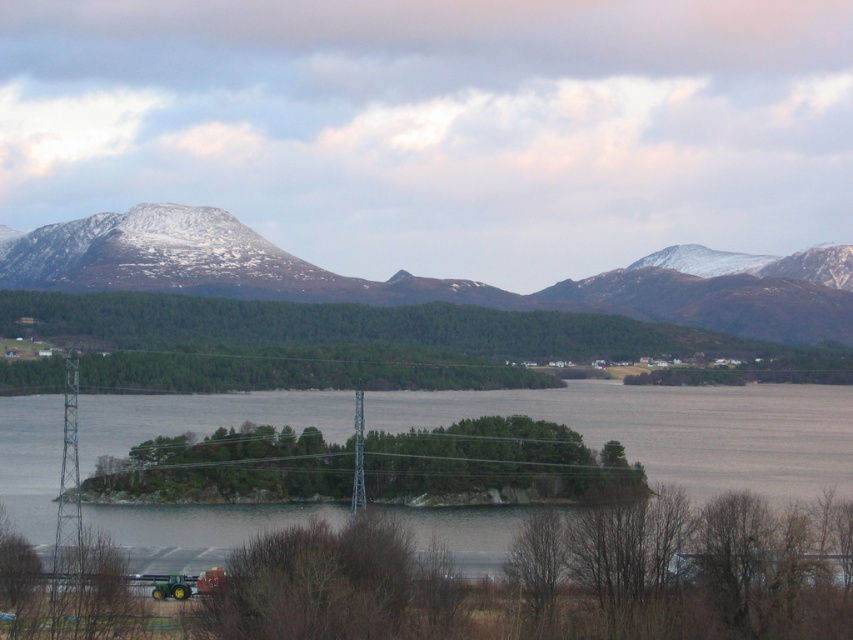
Question: Which point is closer to the camera taking this photo?

Choices:
 (A) (132, 554)
 (B) (160, 269)

Answer: (A)

Question: Is clear water at center to the right of snow-covered mountain at upper center from the viewer's perspective?

Choices:
 (A) yes
 (B) no

Answer: (A)

Question: Is clear water at center thinner than snow-covered mountain at upper center?

Choices:
 (A) yes
 (B) no

Answer: (A)

Question: Which of the following is the farthest from the observer?

Choices:
 (A) (74, 243)
 (B) (321, 509)

Answer: (A)

Question: Is clear water at center to the right of snow-covered mountain at upper center from the viewer's perspective?

Choices:
 (A) yes
 (B) no

Answer: (A)